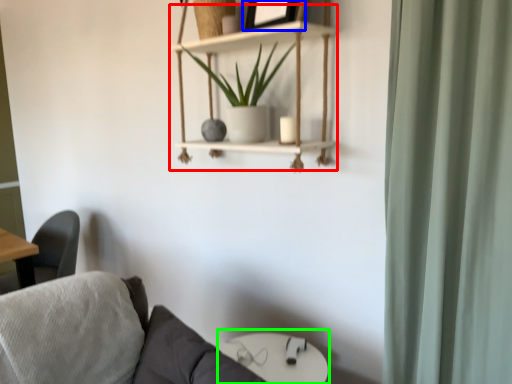
Question: Considering the real-world distances, which object is closest to cabinet (highlighted by a red box)? picture frame (highlighted by a blue box) or round table (highlighted by a green box).

Choices:
 (A) picture frame
 (B) round table

Answer: (A)